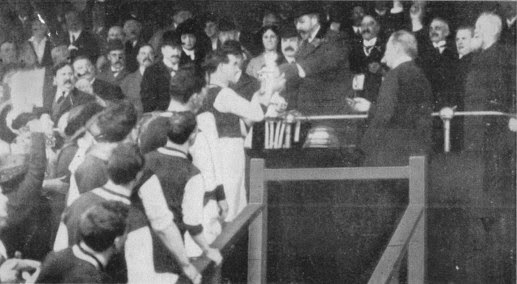
Locate an element on the screen. support beams on railings is located at coordinates (423, 237), (250, 246), (216, 273), (395, 277).